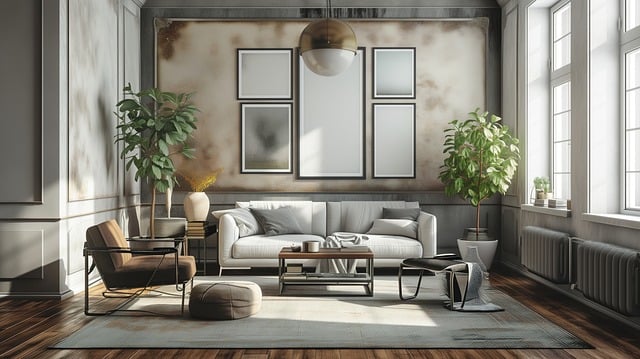
Locate an element on the screen. The height and width of the screenshot is (359, 640). light is located at coordinates (320, 38).